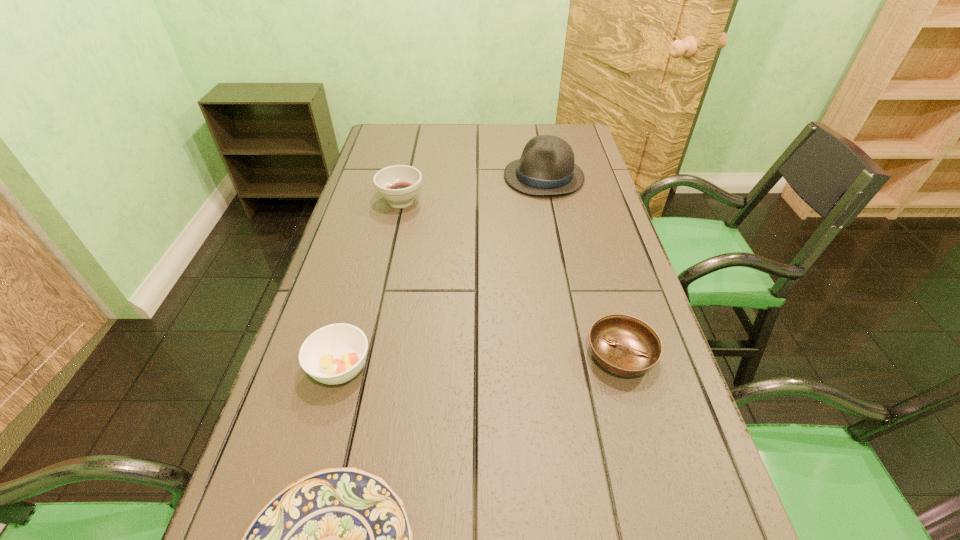
This screenshot has width=960, height=540. In order to click on free space located 0.240m on the right of the second shortest soup bowl in this screenshot , I will do `click(489, 368)`.

Locate an element on the screen. vacant area located 0.060m on the front of the shortest soup bowl is located at coordinates (636, 413).

At what (x,y) coordinates should I click in order to perform the action: click on bowler hat positioned at the right edge. Please return your answer as a coordinate pair (x, y). Image resolution: width=960 pixels, height=540 pixels. Looking at the image, I should click on (547, 166).

In order to click on soup bowl positioned at the right edge in this screenshot , I will do `click(624, 345)`.

Find the location of a particular element. The image size is (960, 540). blank space at the far edge is located at coordinates (515, 154).

This screenshot has width=960, height=540. Find the location of `vacant point at the left edge`. vacant point at the left edge is located at coordinates (265, 444).

In the image, there is a desktop. What are the coordinates of `blank space at the right edge` in the screenshot? It's located at (664, 458).

Locate an element on the screen. The height and width of the screenshot is (540, 960). vacant region at the far left corner of the desktop is located at coordinates (398, 141).

Identify the location of vacant point located between the bowler hat and the third shortest object. (442, 273).

This screenshot has height=540, width=960. Identify the location of empty space that is in between the farthest soup bowl and the shortest soup bowl. (511, 278).